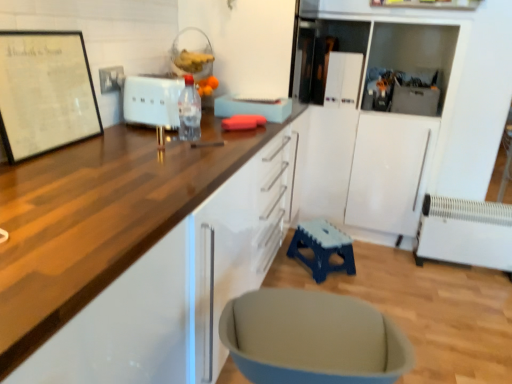
Question: Does wooden countertop at upper left have a larger size compared to blue plastic stool at lower center?

Choices:
 (A) yes
 (B) no

Answer: (A)

Question: Does wooden countertop at upper left touch blue plastic stool at lower center?

Choices:
 (A) yes
 (B) no

Answer: (B)

Question: From a real-world perspective, is wooden countertop at upper left physically above blue plastic stool at lower center?

Choices:
 (A) no
 (B) yes

Answer: (B)

Question: Is blue plastic stool at lower center inside wooden countertop at upper left?

Choices:
 (A) no
 (B) yes

Answer: (A)

Question: Is wooden countertop at upper left taller than blue plastic stool at lower center?

Choices:
 (A) no
 (B) yes

Answer: (B)

Question: Is wooden countertop at upper left positioned behind blue plastic stool at lower center?

Choices:
 (A) yes
 (B) no

Answer: (B)

Question: Does transparent plastic bottle at center have a greater width compared to blue plastic stool at lower center?

Choices:
 (A) no
 (B) yes

Answer: (A)

Question: Is transparent plastic bottle at center closer to the viewer compared to blue plastic stool at lower center?

Choices:
 (A) no
 (B) yes

Answer: (B)

Question: Does transparent plastic bottle at center turn towards blue plastic stool at lower center?

Choices:
 (A) yes
 (B) no

Answer: (B)

Question: Does transparent plastic bottle at center have a greater height compared to blue plastic stool at lower center?

Choices:
 (A) no
 (B) yes

Answer: (B)

Question: Is transparent plastic bottle at center placed right next to blue plastic stool at lower center?

Choices:
 (A) no
 (B) yes

Answer: (A)

Question: Is transparent plastic bottle at center not inside blue plastic stool at lower center?

Choices:
 (A) no
 (B) yes

Answer: (B)

Question: Is metallic gray toolbox at upper right, marked as the 2th appliance in a back-to-front arrangement, closer to camera compared to white matte toaster at center, which is the third appliance in back-to-front order?

Choices:
 (A) no
 (B) yes

Answer: (A)